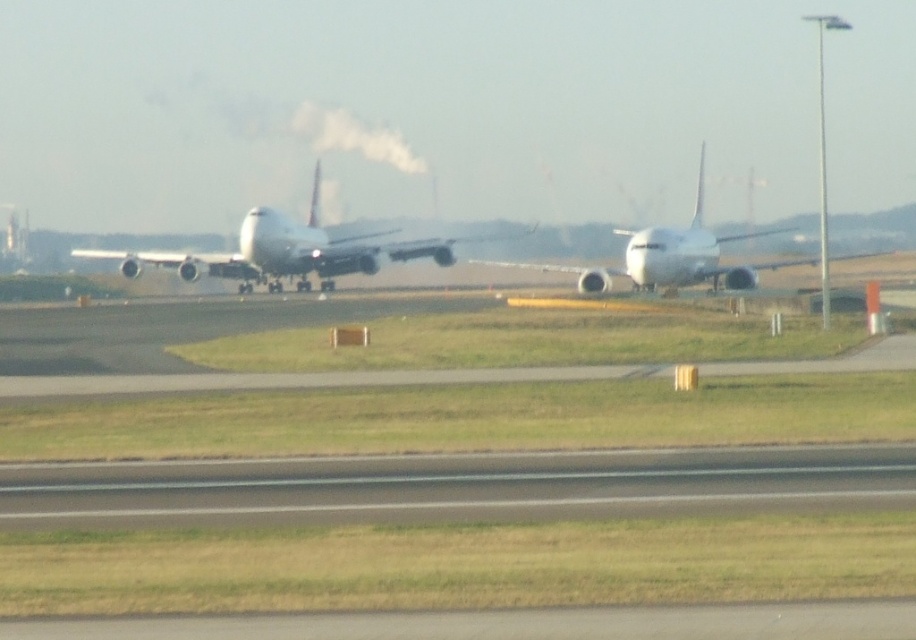
Question: Which object is positioned closest to the gray asphalt runway at lower center?

Choices:
 (A) white glossy airplane at center
 (B) white matte airplane at center

Answer: (A)

Question: Is gray asphalt runway at lower center above white glossy airplane at center?

Choices:
 (A) no
 (B) yes

Answer: (A)

Question: Which point appears farthest from the camera in this image?

Choices:
 (A) (238, 230)
 (B) (165, 483)

Answer: (A)

Question: Is the position of white matte airplane at center more distant than that of white glossy airplane at center?

Choices:
 (A) yes
 (B) no

Answer: (A)

Question: Based on their relative distances, which object is nearer to the white glossy airplane at center?

Choices:
 (A) white matte airplane at center
 (B) gray asphalt runway at lower center

Answer: (A)

Question: Does gray asphalt runway at lower center appear over white matte airplane at center?

Choices:
 (A) no
 (B) yes

Answer: (A)